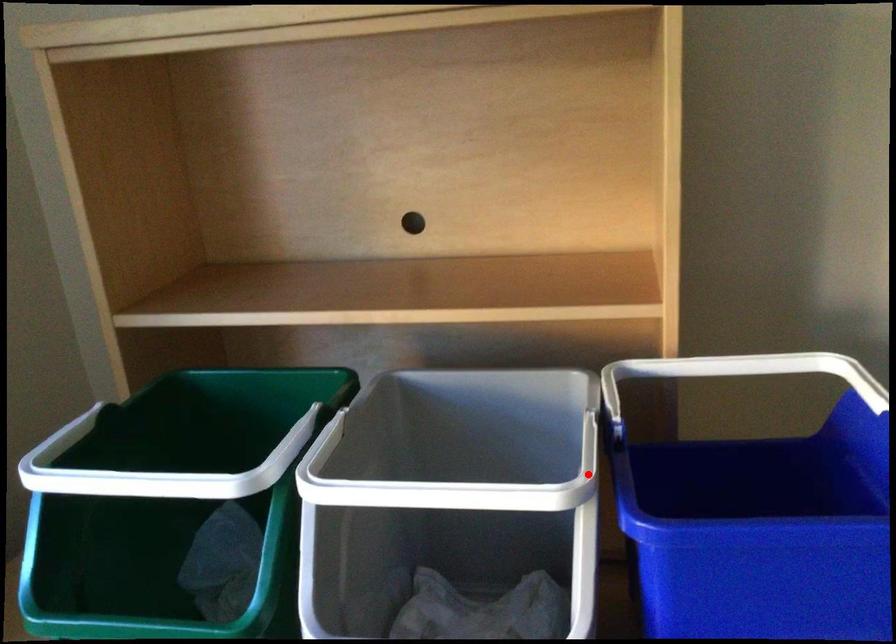
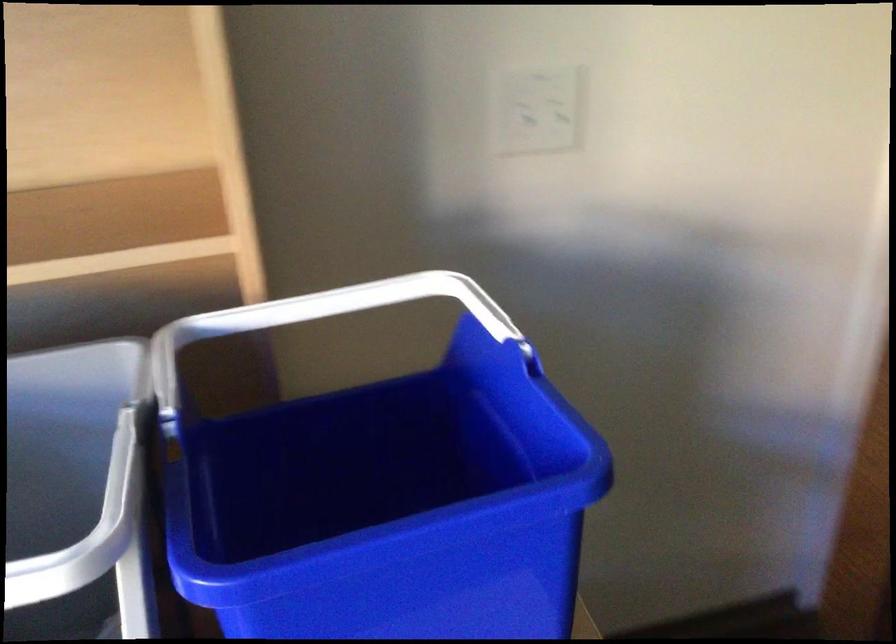
Where in the second image is the point corresponding to the highlighted location from the first image?

(125, 529)